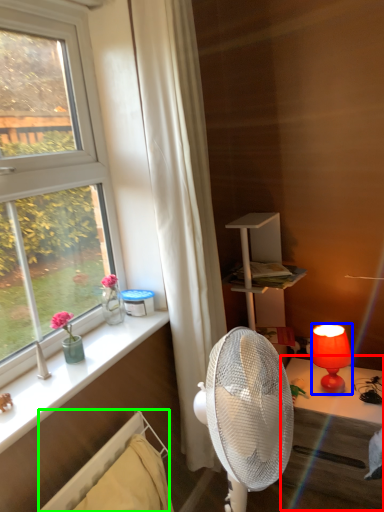
Question: Estimate the real-world distances between objects in this image. Which object is closer to table (highlighted by a red box), lamp (highlighted by a blue box) or radiator (highlighted by a green box)?

Choices:
 (A) lamp
 (B) radiator

Answer: (A)